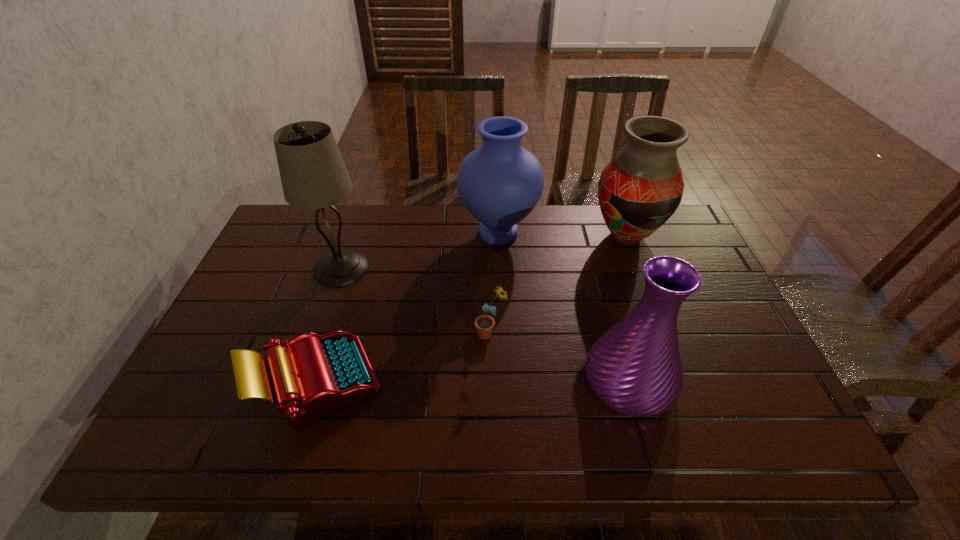
Where is `vacant space located 0.400m on the flower of the sunflower`? The width and height of the screenshot is (960, 540). vacant space located 0.400m on the flower of the sunflower is located at coordinates tap(316, 334).

Identify the location of vacant space located 0.370m on the typing side of the shortest object. Image resolution: width=960 pixels, height=540 pixels. (543, 382).

Identify the location of lampshade that is positioned at the far edge. (313, 174).

Where is `vase situated at the near edge`? The width and height of the screenshot is (960, 540). vase situated at the near edge is located at coordinates (635, 368).

Find the location of a particular element. This screenshot has width=960, height=540. typewriter positioned at the near edge is located at coordinates (315, 375).

Find the location of a particular element. object situated at the left edge is located at coordinates (315, 375).

The image size is (960, 540). What are the coordinates of `object situated at the right edge` in the screenshot? It's located at (641, 187).

I want to click on object situated at the near left corner, so click(x=315, y=375).

I want to click on object that is positioned at the far right corner, so click(x=641, y=187).

Find the location of a particular element. vacant space at the far edge is located at coordinates (475, 228).